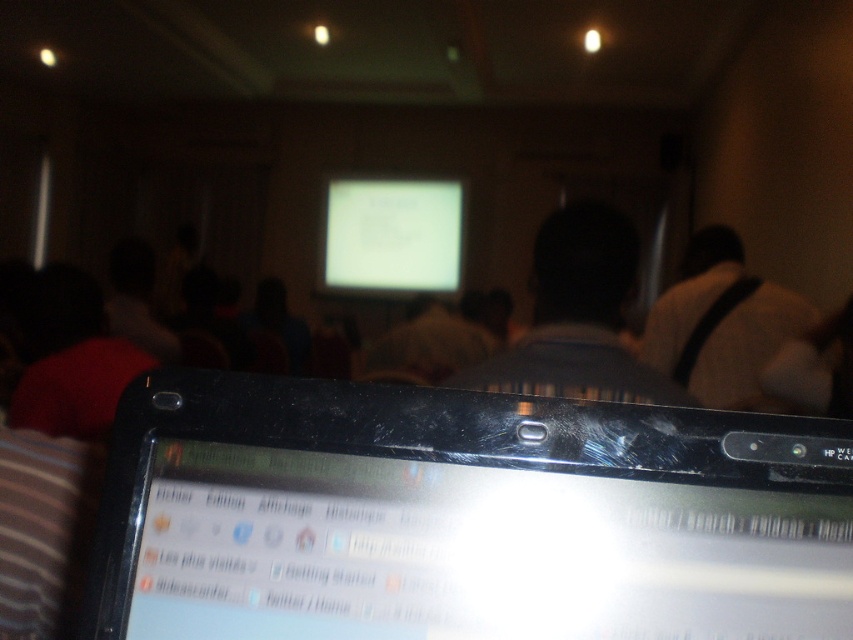
Question: Considering the relative positions of black plastic laptop at bottom and white glossy screen at center in the image provided, where is black plastic laptop at bottom located with respect to white glossy screen at center?

Choices:
 (A) right
 (B) left

Answer: (A)

Question: Which of the following is the closest to the observer?

Choices:
 (A) white fabric bag at upper right
 (B) black plastic laptop at bottom

Answer: (B)

Question: Can you confirm if matte black laptop at center is positioned above white fabric bag at upper right?

Choices:
 (A) yes
 (B) no

Answer: (B)

Question: Can you confirm if black plastic laptop at bottom is smaller than white glossy screen at center?

Choices:
 (A) yes
 (B) no

Answer: (A)

Question: Among these objects, which one is farthest from the camera?

Choices:
 (A) white glossy screen at center
 (B) matte black laptop at center
 (C) white fabric bag at upper right
 (D) black plastic laptop at bottom

Answer: (A)

Question: Among these points, which one is farthest from the camera?

Choices:
 (A) (622, 268)
 (B) (741, 301)
 (C) (729, 528)
 (D) (428, 275)

Answer: (D)